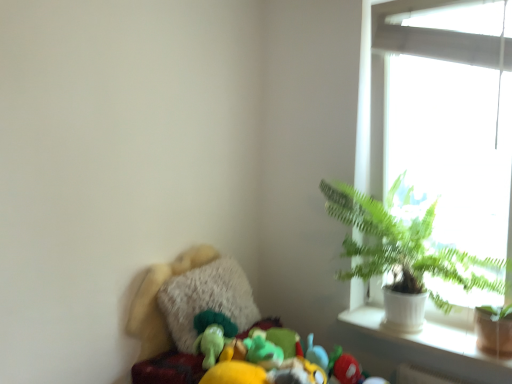
Image resolution: width=512 pixels, height=384 pixels. I want to click on vacant space to the left of white ceramic pot at right, so click(x=449, y=342).